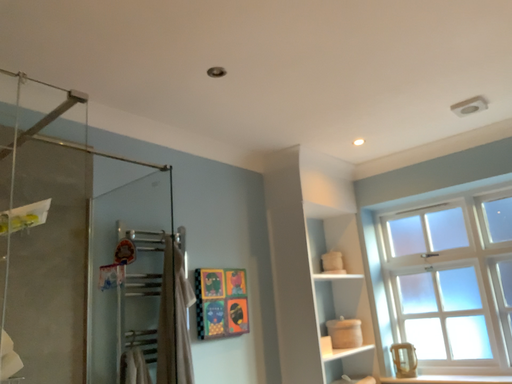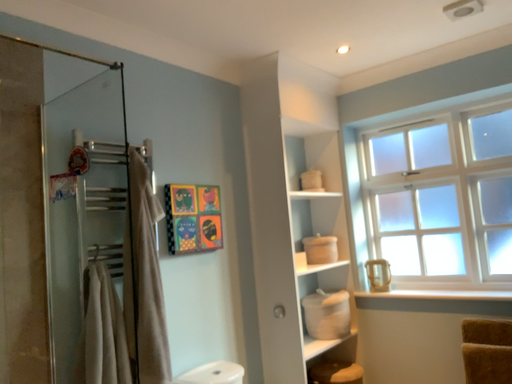
Question: Which way did the camera rotate in the video?

Choices:
 (A) rotated upward
 (B) rotated downward

Answer: (B)